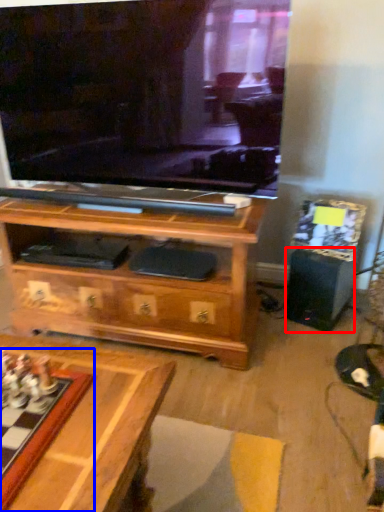
Question: Which object is further to the camera taking this photo, speaker (highlighted by a red box) or board game (highlighted by a blue box)?

Choices:
 (A) speaker
 (B) board game

Answer: (A)